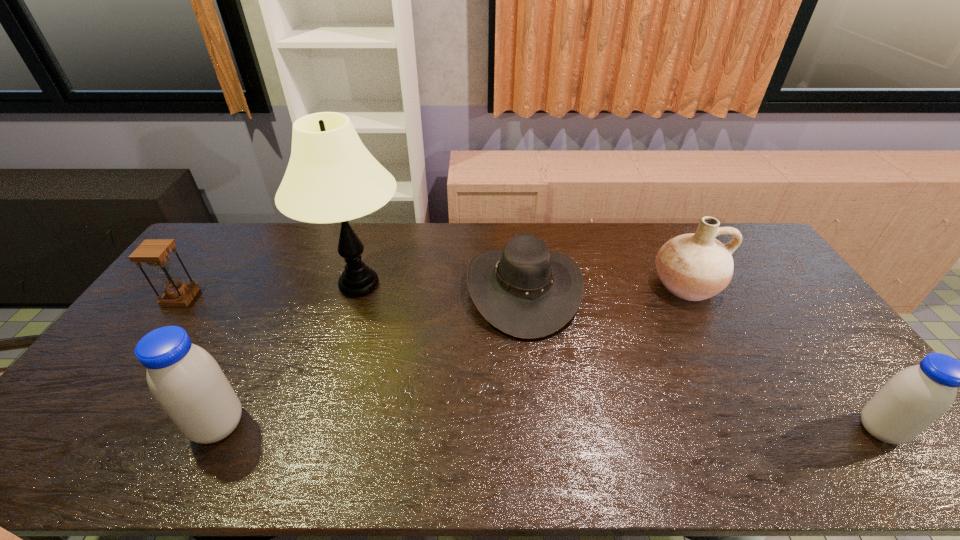
Image resolution: width=960 pixels, height=540 pixels. Identify the location of lamp. (331, 177).

Identify the location of vacant space located on the right of the fifth object from right to left. The width and height of the screenshot is (960, 540). (277, 426).

Locate an element on the screen. The width and height of the screenshot is (960, 540). vacant space situated on the left of the shorter soya milk is located at coordinates (801, 430).

This screenshot has height=540, width=960. What are the coordinates of `vacant region located 0.070m on the right of the leftmost object` in the screenshot? It's located at 216,298.

The height and width of the screenshot is (540, 960). Identify the location of vacant space located to pour from the handle of the second object from right to left. (732, 373).

I want to click on vacant region located on the front-facing side of the fourth object from left to right, so click(372, 289).

Identify the location of vacant space located on the front-facing side of the fourth object from left to right. (427, 289).

This screenshot has width=960, height=540. Find the location of `free location located 0.050m on the front-facing side of the fourth object from left to right`. free location located 0.050m on the front-facing side of the fourth object from left to right is located at coordinates (451, 289).

Where is `vacant space located on the left of the third object from left to right`? vacant space located on the left of the third object from left to right is located at coordinates pyautogui.click(x=210, y=285).

In order to click on cowboy hat that is at the far edge in this screenshot , I will do `click(525, 290)`.